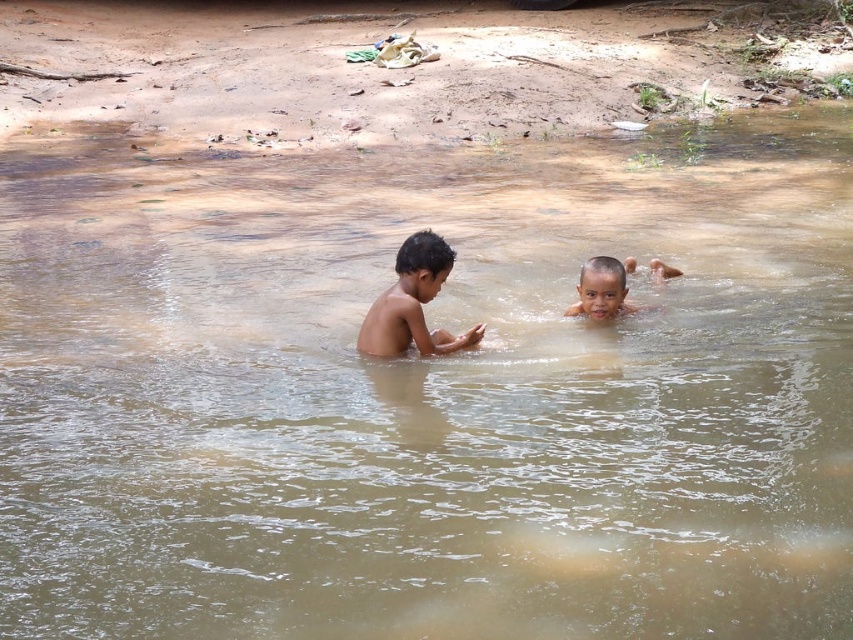
Question: Can you confirm if light brown skin at center is wider than smooth skin child at center?

Choices:
 (A) yes
 (B) no

Answer: (A)

Question: Which of the following is the closest to the observer?

Choices:
 (A) smooth skin child at center
 (B) light brown skin at center

Answer: (B)

Question: Which object appears farthest from the camera in this image?

Choices:
 (A) smooth skin child at center
 (B) light brown skin at center

Answer: (A)

Question: Can you confirm if light brown skin at center is positioned to the left of smooth skin child at center?

Choices:
 (A) yes
 (B) no

Answer: (A)

Question: Which point is closer to the camera?

Choices:
 (A) light brown skin at center
 (B) smooth skin child at center

Answer: (A)

Question: Observing the image, what is the correct spatial positioning of light brown skin at center in reference to smooth skin child at center?

Choices:
 (A) right
 (B) left

Answer: (B)